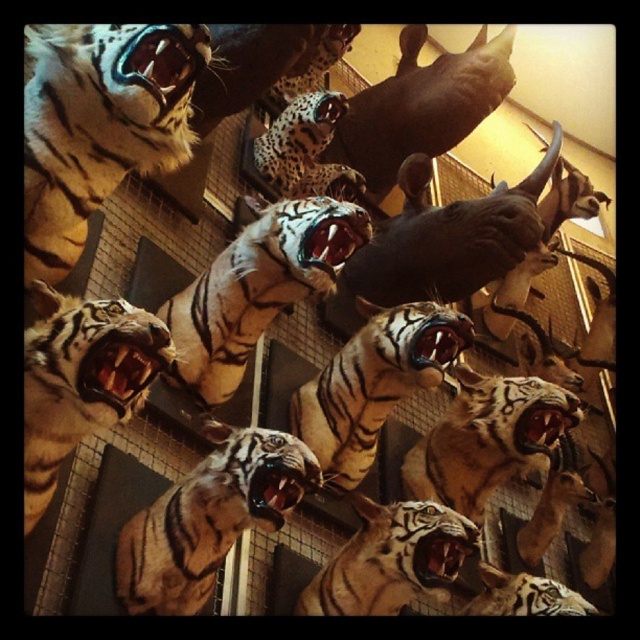
Question: Is shiny golden tiger at center to the left of shiny orange tiger at center from the viewer's perspective?

Choices:
 (A) no
 (B) yes

Answer: (A)

Question: Is the position of shiny golden tiger at center less distant than that of shiny orange tiger at center?

Choices:
 (A) no
 (B) yes

Answer: (B)

Question: Does shiny golden tiger at center appear under shiny orange tiger at center?

Choices:
 (A) yes
 (B) no

Answer: (A)

Question: Which point appears farthest from the camera in this image?

Choices:
 (A) (198, 292)
 (B) (138, 564)

Answer: (A)